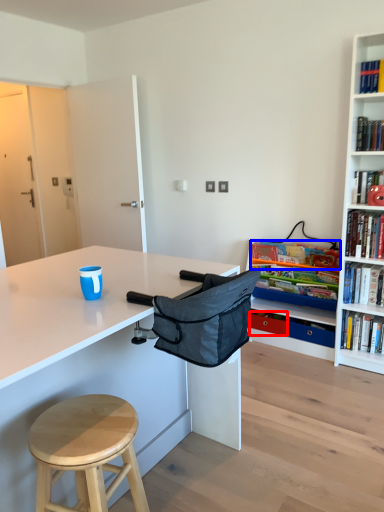
Question: Which point is further to the camera, drawer (highlighted by a red box) or book (highlighted by a blue box)?

Choices:
 (A) drawer
 (B) book

Answer: (A)